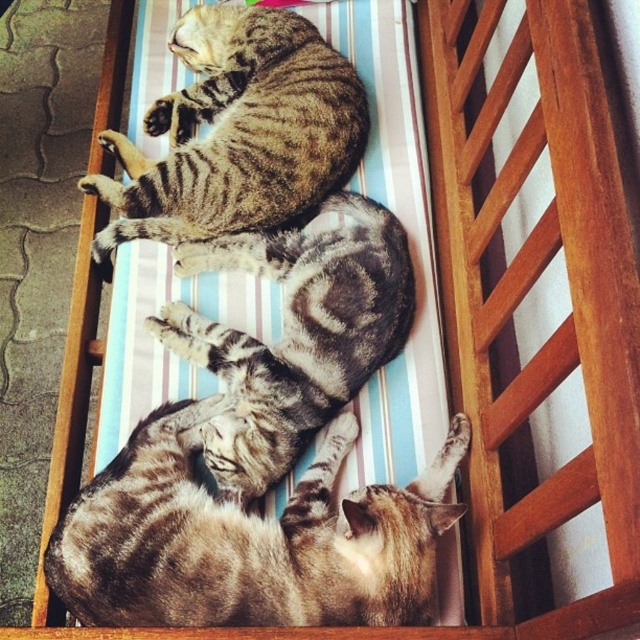
You are a cat owner looking at the image of your cats on the cushion. You want to know which of your cats, the tabby fur cat at upper center or the tabby fur cat at center, is positioned higher up on the cushion. Based on the scene, can you determine this?

The tabby fur cat at upper center is positioned higher up on the cushion than the tabby fur cat at center because it is described as being taller in the scene.

You are looking at the image of three cats on a striped cushion. Where is the tabby fur cat at upper center located in terms of its 2D coordinates?

The tabby fur cat at upper center is located at the 2D coordinates of point (x=237, y=131).